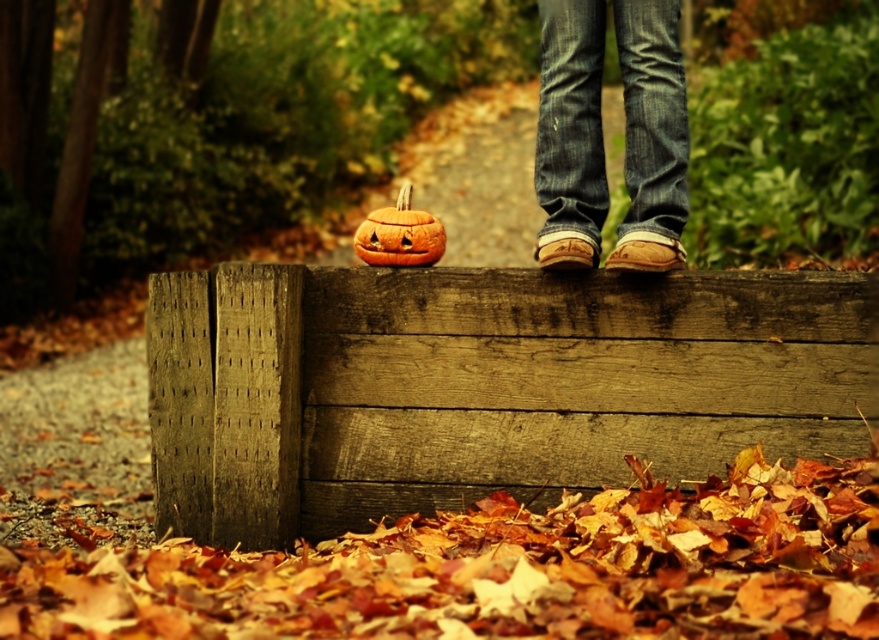
Question: In this image, where is weathered wood at center located relative to orange matte pumpkin at center?

Choices:
 (A) above
 (B) below

Answer: (B)

Question: Considering the relative positions of weathered wood at center and denim jeans at center in the image provided, where is weathered wood at center located with respect to denim jeans at center?

Choices:
 (A) right
 (B) left

Answer: (B)

Question: Is denim jeans at center below orange matte pumpkin at center?

Choices:
 (A) no
 (B) yes

Answer: (A)

Question: Which point is closer to the camera?

Choices:
 (A) (536, 141)
 (B) (384, 460)

Answer: (B)

Question: Which point is farther to the camera?

Choices:
 (A) autumn leaves at lower center
 (B) weathered wood at center
 (C) orange matte pumpkin at center
 (D) denim jeans at center

Answer: (C)

Question: Which point is farther from the camera taking this photo?

Choices:
 (A) (672, 547)
 (B) (542, 186)
 (C) (438, 232)

Answer: (B)